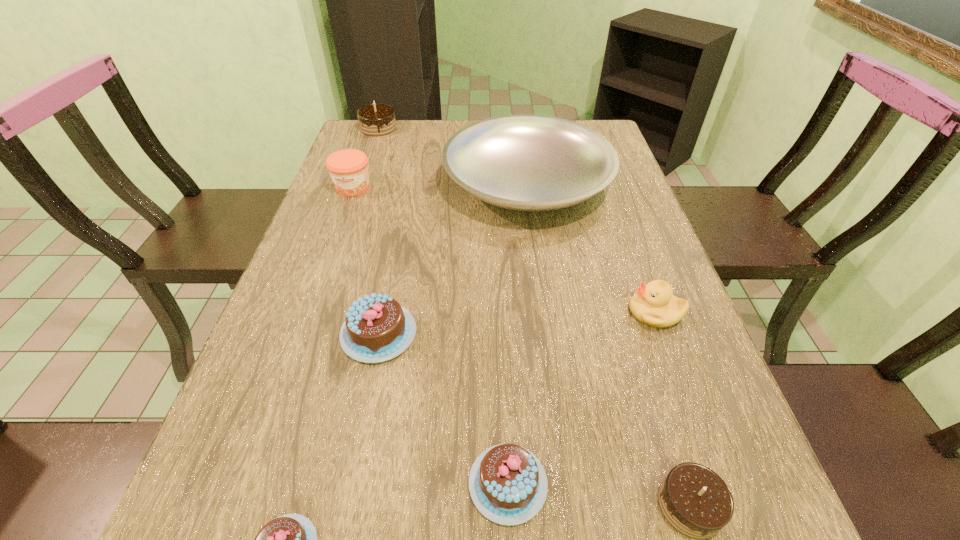
The image size is (960, 540). Find the location of `chocolate cake positioned at the far edge`. chocolate cake positioned at the far edge is located at coordinates (375, 119).

The width and height of the screenshot is (960, 540). Find the location of `bedpan that is at the far edge`. bedpan that is at the far edge is located at coordinates [523, 162].

This screenshot has height=540, width=960. In order to click on jam that is at the left edge in this screenshot , I will do `click(348, 168)`.

This screenshot has height=540, width=960. What are the coordinates of `bedpan that is at the right edge` in the screenshot? It's located at (523, 162).

Locate an element on the screen. This screenshot has height=540, width=960. duckling that is at the right edge is located at coordinates (654, 304).

This screenshot has height=540, width=960. In order to click on chocolate cake located in the right edge section of the desktop in this screenshot , I will do `click(695, 501)`.

This screenshot has height=540, width=960. What are the coordinates of `object that is at the far left corner` in the screenshot? It's located at click(x=375, y=119).

Where is `object at the far right corner`? The image size is (960, 540). object at the far right corner is located at coordinates (523, 162).

Find the location of `object that is at the near right corner`. object that is at the near right corner is located at coordinates (695, 501).

You are a GUI agent. You are given a task and a screenshot of the screen. Output one action in this format:
    pyautogui.click(x=<x>, y=<y>)
    Task: Click on the vacant space at the far edge
    
    Given the screenshot: What is the action you would take?
    (x=434, y=141)